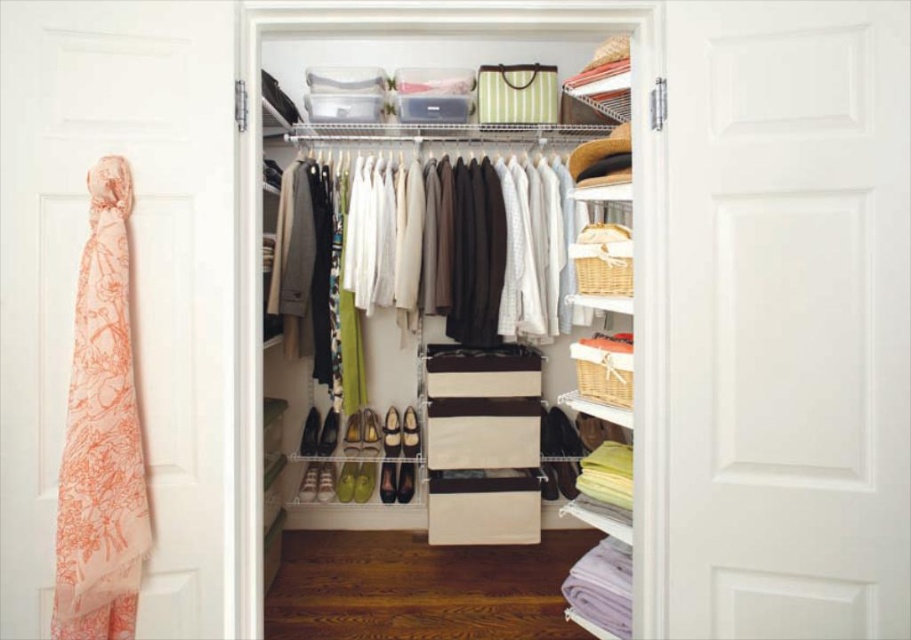
Locate an element on the screen. peach silk scarf at left is located at coordinates (132, 280).

Does peach silk scarf at left appear over matte white closet at center?

Indeed, peach silk scarf at left is positioned over matte white closet at center.

Locate an element on the screen. The height and width of the screenshot is (640, 911). peach silk scarf at left is located at coordinates (132, 280).

Does white matte door at center appear under peach floral scarf at left?

No, white matte door at center is not below peach floral scarf at left.

Between white matte door at center and peach floral scarf at left, which one has more height?

white matte door at center

Image resolution: width=911 pixels, height=640 pixels. What do you see at coordinates (787, 320) in the screenshot? I see `white matte door at center` at bounding box center [787, 320].

Locate an element on the screen. white matte door at center is located at coordinates (787, 320).

Can you confirm if matte white closet at center is positioned to the right of peach floral scarf at left?

Correct, you'll find matte white closet at center to the right of peach floral scarf at left.

Can you confirm if matte white closet at center is positioned to the left of peach floral scarf at left?

No, matte white closet at center is not to the left of peach floral scarf at left.

I want to click on matte white closet at center, so click(259, 241).